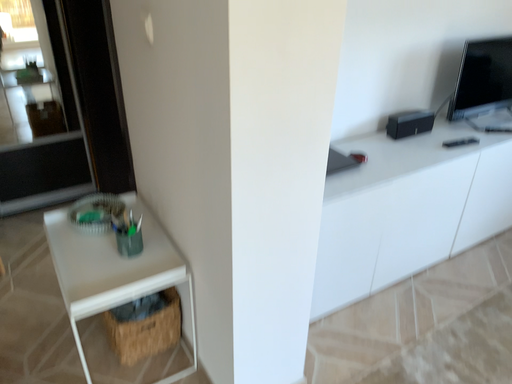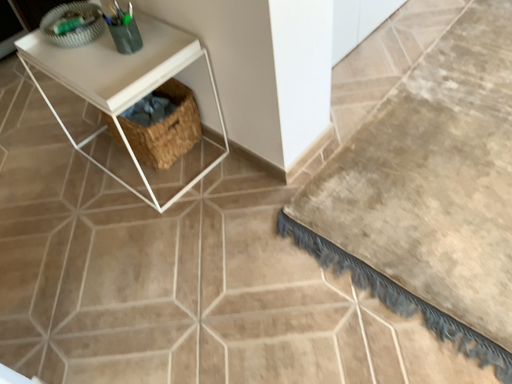
Question: How did the camera likely rotate when shooting the video?

Choices:
 (A) rotated right
 (B) rotated left

Answer: (A)